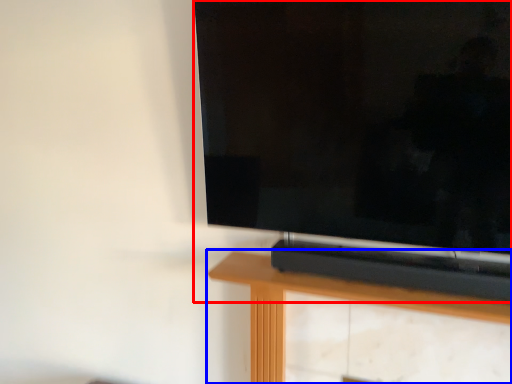
Question: Among these objects, which one is nearest to the camera, television (highlighted by a red box) or furniture (highlighted by a blue box)?

Choices:
 (A) television
 (B) furniture

Answer: (A)